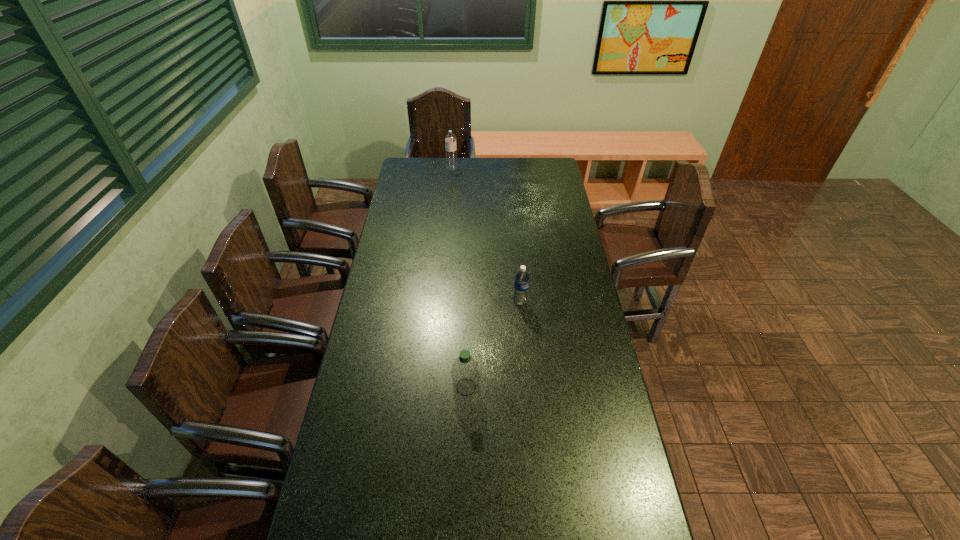
Where is `the leftmost object`? Image resolution: width=960 pixels, height=540 pixels. the leftmost object is located at coordinates (450, 139).

Image resolution: width=960 pixels, height=540 pixels. Identify the location of the tallest object. (450, 139).

Find the location of a particular element. This screenshot has width=960, height=540. the second farthest object is located at coordinates (521, 284).

The image size is (960, 540). I want to click on the second farthest water bottle, so click(521, 284).

Find the location of a particular element. The height and width of the screenshot is (540, 960). the nearest object is located at coordinates (465, 371).

Where is `the second object from left to right`? The image size is (960, 540). the second object from left to right is located at coordinates (465, 371).

You are a GUI agent. You are given a task and a screenshot of the screen. Output one action in this format:
    pyautogui.click(x=<x>, y=<y>)
    Task: Click on the vacant area located on the left of the tallest water bottle
    
    Given the screenshot: What is the action you would take?
    pyautogui.click(x=424, y=168)

Where is `vacant region located 0.200m on the front of the rightmost water bottle`? This screenshot has width=960, height=540. vacant region located 0.200m on the front of the rightmost water bottle is located at coordinates (524, 350).

The height and width of the screenshot is (540, 960). In order to click on vacant space located on the right of the second water bottle from right to left in this screenshot , I will do `click(495, 387)`.

Locate an element on the screen. Image resolution: width=960 pixels, height=540 pixels. object that is at the far edge is located at coordinates (450, 139).